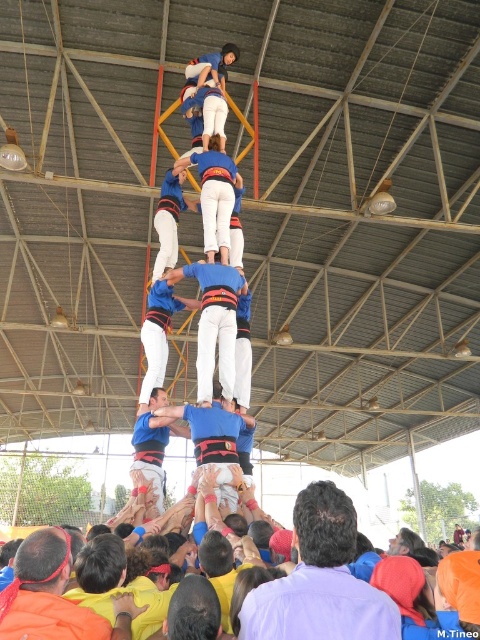
Can you confirm if purple shirt at center is smaller than blue fabric pants at center?

Yes.

Can you confirm if purple shirt at center is thinner than blue fabric pants at center?

Yes, purple shirt at center is thinner than blue fabric pants at center.

Between point (298, 529) and point (222, 180), which one is positioned behind?

The point (222, 180) is behind.

The width and height of the screenshot is (480, 640). In order to click on purple shirt at center in this screenshot , I will do `click(320, 580)`.